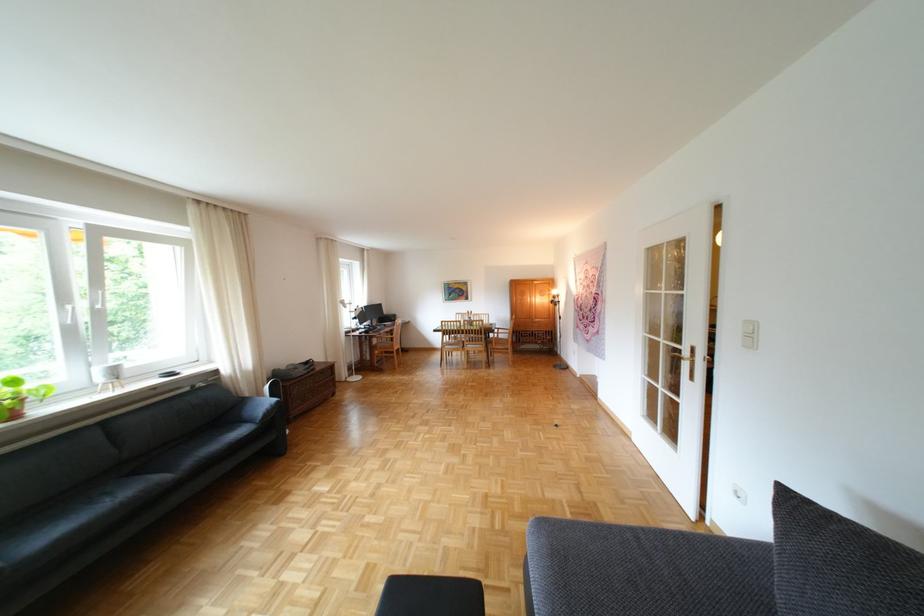
Where would you lift the wooden chest lid? Please return your answer as a coordinate pair (x, y).

(532, 312)